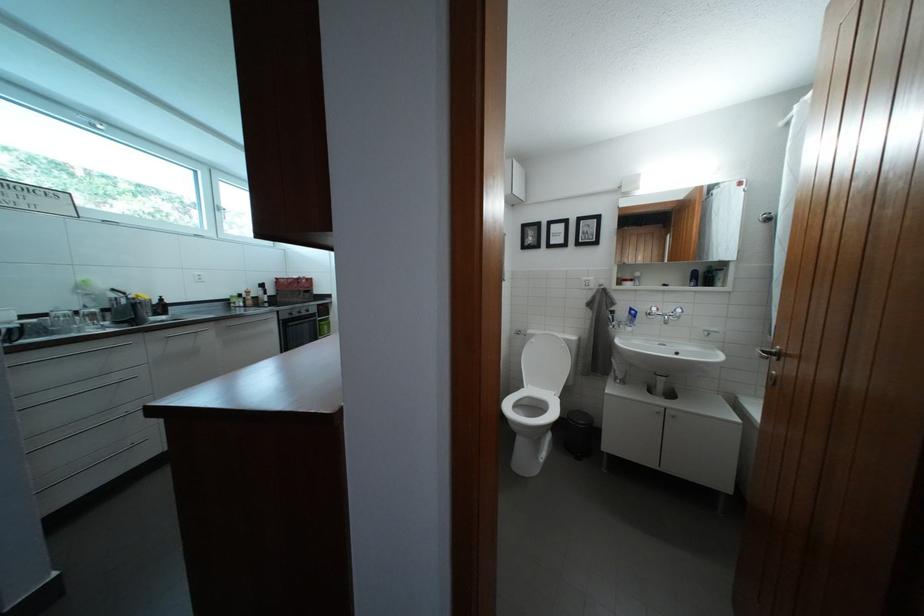
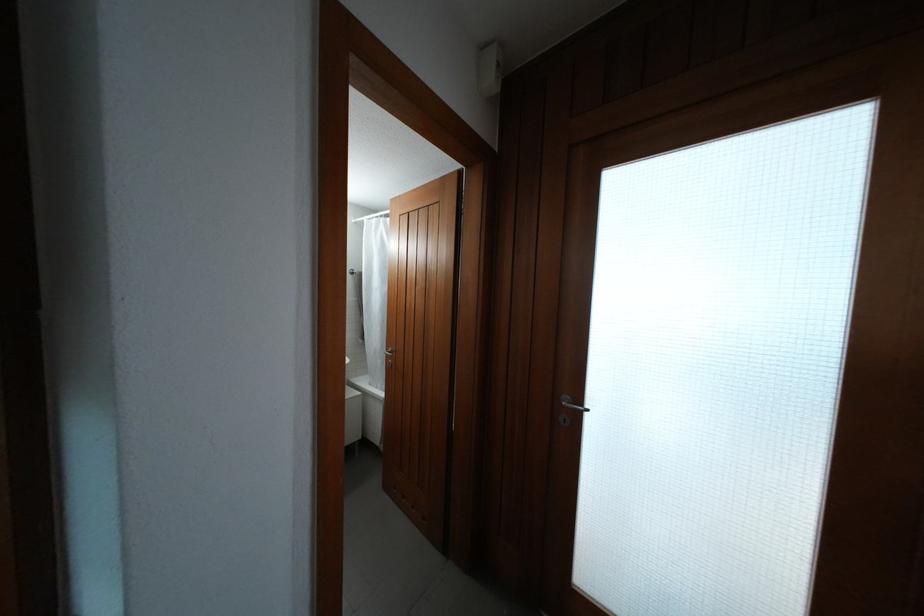
Question: The first image is from the beginning of the video and the second image is from the end. How did the camera likely rotate when shooting the video?

Choices:
 (A) Left
 (B) Right
 (C) Up
 (D) Down

Answer: (B)